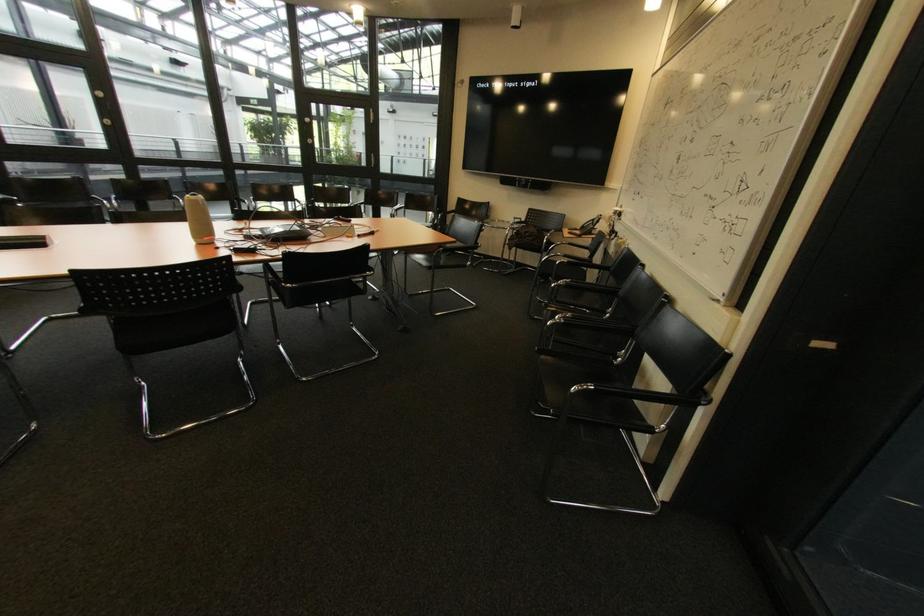
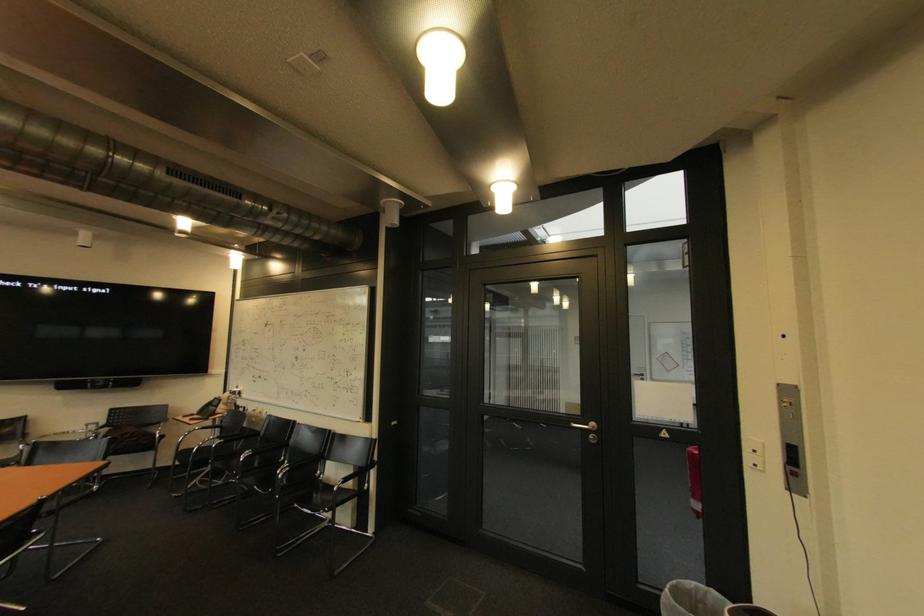
Where in the second image is the point corresponding to point 586,231 from the first image?

(204, 416)